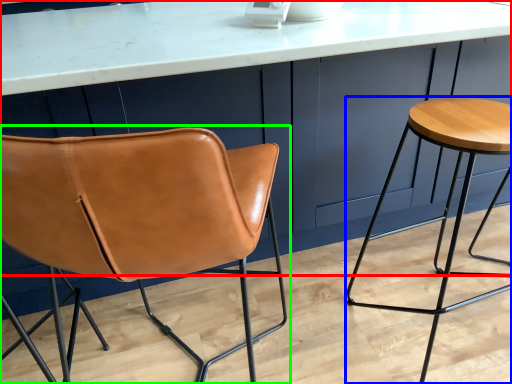
Question: Based on their relative distances, which object is nearer to counter (highlighted by a red box)? Choose from stool (highlighted by a blue box) and chair (highlighted by a green box).

Choices:
 (A) stool
 (B) chair

Answer: (B)